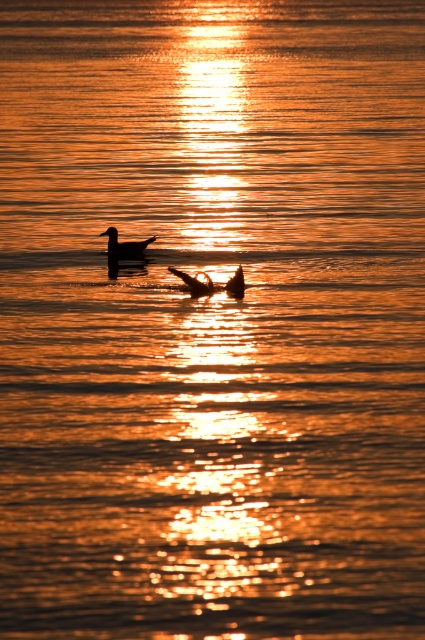
You are a photographer trying to capture the silhouette glossy duck at upper center in the center of your camera frame. The camera has a crosshair that shows the exact center at coordinates point 0.5, 0.5. Based on the duck position at point 0.384, 0.292, should you move the camera frame to the left or right to center the duck?

The silhouette glossy duck at upper center is located at point (124, 244). Since the camera frame center is at (212, 320), the duck is to the left and below the center. To center it, move the frame to the left and upward. However, since the question specifies left or right only, focus on the horizontal axis. The duck is left of center on the x axis, so move the frame to the right to bring the duck to the center.

You are a photographer trying to capture the sunset reflection on the water. You notice a point at coordinates (124, 244) in the image. What object is located at this point?

The point at coordinates (124, 244) corresponds to the silhouette glossy duck at upper center.

Looking at this image, you are a photographer trying to capture the sunset scene. You notice two ducks in the water. The silhouette glossy duck at upper center and the silhouette feathered duck at center. Which duck is closer to the camera based on their positions?

The silhouette glossy duck at upper center is closer to the camera because the silhouette feathered duck at center is behind it.